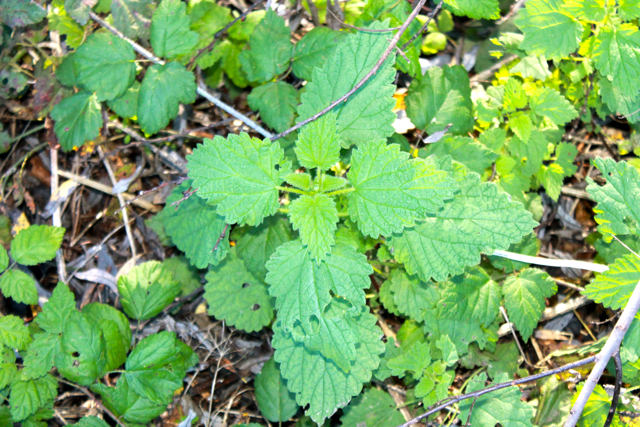
You are a GUI agent. You are given a task and a screenshot of the screen. Output one action in this format:
    pyautogui.click(x=<x>, y=<y>)
    Task: Click on the light
    
    Given the screenshot: What is the action you would take?
    pyautogui.click(x=592, y=24)